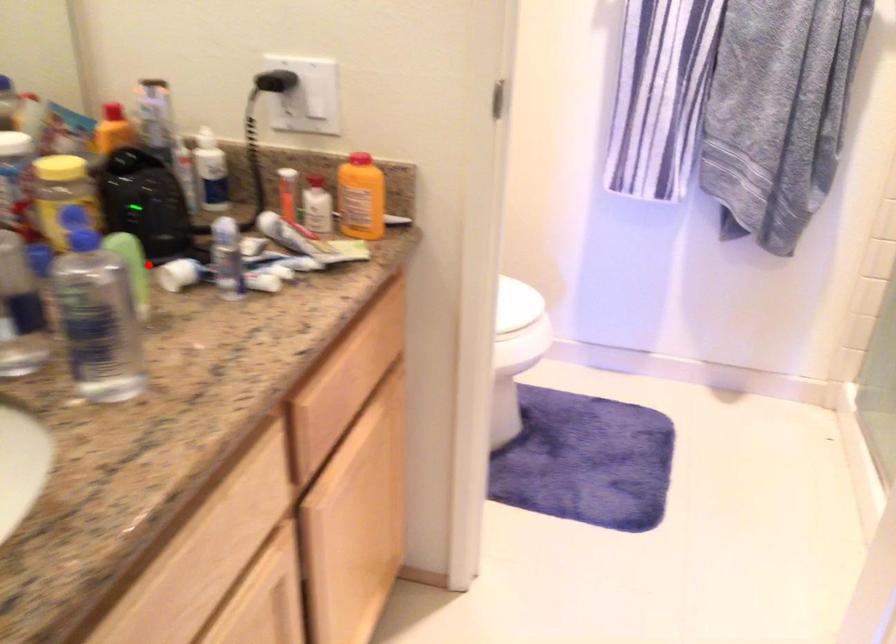
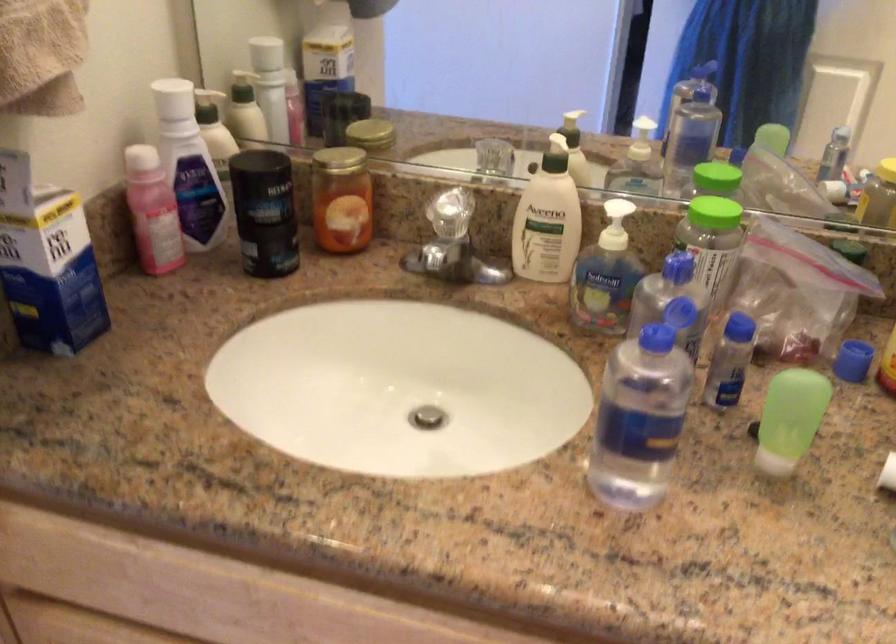
Question: I am providing you with two images of the same scene from different viewpoints. Image1 has a red point marked. In image2, the corresponding 3D location appears at what relative position? Reply with the corresponding letter.

Choices:
 (A) Closer
 (B) Farther

Answer: (A)